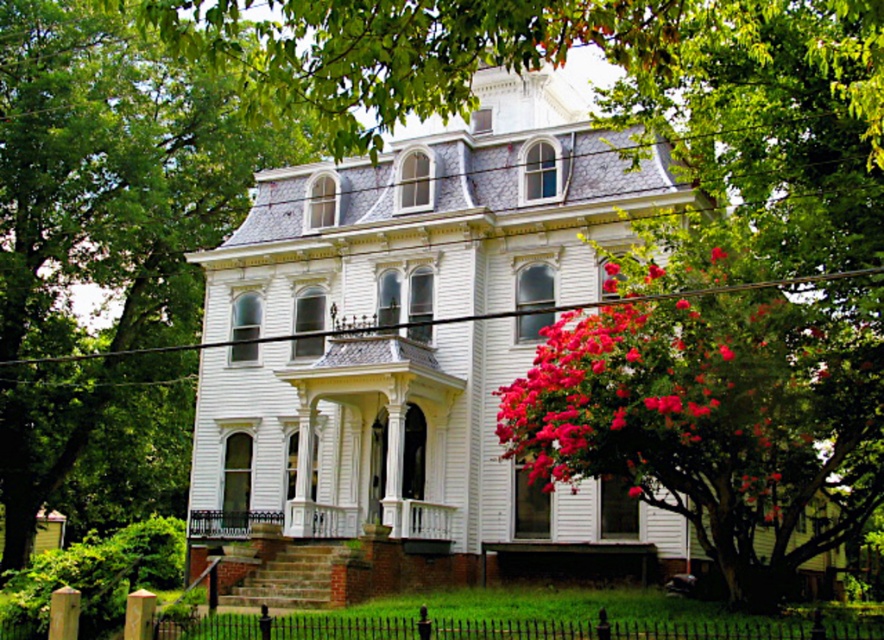
Which of these two, green leafy tree at upper left or vivid pink petals at right, stands taller?

With more height is green leafy tree at upper left.

Does green leafy tree at upper left have a smaller size compared to vivid pink petals at right?

No, green leafy tree at upper left is not smaller than vivid pink petals at right.

You are a GUI agent. You are given a task and a screenshot of the screen. Output one action in this format:
    pyautogui.click(x=<x>, y=<y>)
    Task: Click on the green leafy tree at upper left
    Image resolution: width=884 pixels, height=640 pixels.
    Given the screenshot: What is the action you would take?
    pyautogui.click(x=112, y=177)

You are a GUI agent. You are given a task and a screenshot of the screen. Output one action in this format:
    pyautogui.click(x=<x>, y=<y>)
    Task: Click on the green leafy tree at upper left
    
    Given the screenshot: What is the action you would take?
    pyautogui.click(x=112, y=177)

Between point (97, 141) and point (246, 529), which one is positioned behind?

Point (97, 141)

Can you confirm if green leafy tree at upper left is shorter than white painted wood porch at center?

Incorrect, green leafy tree at upper left's height does not fall short of white painted wood porch at center's.

Between point (248, 168) and point (248, 525), which one is positioned behind?

The point (248, 168) is behind.

Identify the location of green leafy tree at upper left. (112, 177).

Is vivid pink petals at right positioned behind white painted wood porch at center?

No, vivid pink petals at right is in front of white painted wood porch at center.

Is vivid pink petals at right shorter than white painted wood porch at center?

Incorrect, vivid pink petals at right's height does not fall short of white painted wood porch at center's.

Is point (592, 326) positioned after point (329, 515)?

That is False.

This screenshot has height=640, width=884. What are the coordinates of `vivid pink petals at right` in the screenshot? It's located at (669, 403).